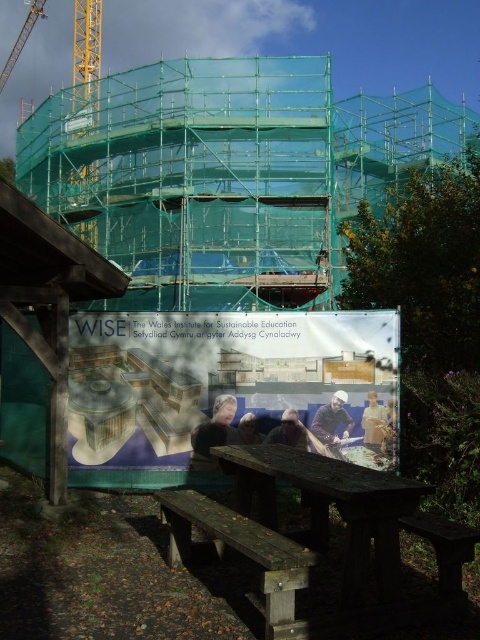
Does transparent plastic billboard at center lie behind dark blue sweater at center?

No, it is in front of dark blue sweater at center.

Who is higher up, transparent plastic billboard at center or dark blue sweater at center?

transparent plastic billboard at center

This screenshot has height=640, width=480. What are the coordinates of `transparent plastic billboard at center` in the screenshot? It's located at (226, 380).

Looking at this image, is wooden bench at lower center above light brown wooden bench at center?

No.

How much distance is there between wooden bench at lower center and light brown wooden bench at center?

wooden bench at lower center is 2.77 meters away from light brown wooden bench at center.

Between point (263, 588) and point (385, 433), which one is positioned behind?

Point (385, 433)

This screenshot has height=640, width=480. Find the location of `wooden bench at lower center`. wooden bench at lower center is located at coordinates (242, 554).

Who is lower down, light brown wooden bench at center or smooth brown hair at center?

smooth brown hair at center

Locate an element on the screen. The height and width of the screenshot is (640, 480). light brown wooden bench at center is located at coordinates point(374,424).

In order to click on light brown wooden bench at center in this screenshot , I will do `click(374, 424)`.